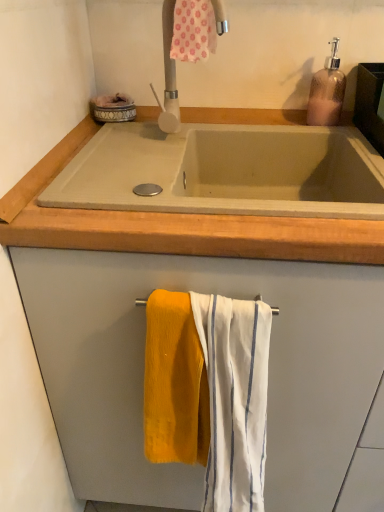
Locate an element on the screen. The width and height of the screenshot is (384, 512). free space to the left of white matte tap at upper center is located at coordinates (120, 140).